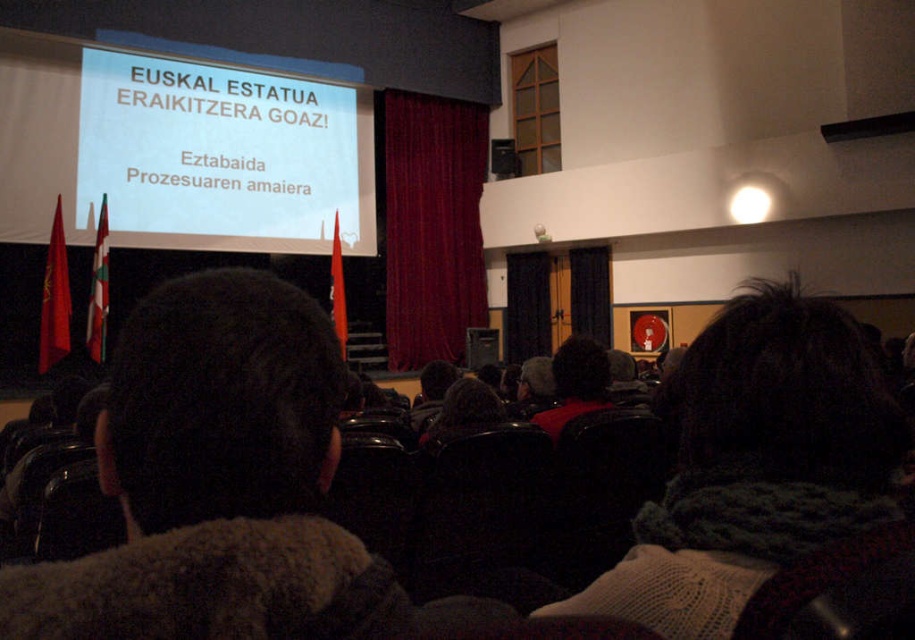
From the picture: Can you confirm if knitted scarf at center is positioned below white glossy projector screen at upper center?

Yes.

Which of these two, knitted scarf at center or white glossy projector screen at upper center, stands shorter?

Standing shorter between the two is knitted scarf at center.

Who is more distant from viewer, (782, 412) or (156, 182)?

The point (156, 182) is behind.

This screenshot has width=915, height=640. Find the location of `knitted scarf at center`. knitted scarf at center is located at coordinates (756, 461).

Is point (321, 353) farther from camera compared to point (608, 339)?

No, (321, 353) is in front of (608, 339).

How much distance is there between dark brown fur coat at center and black fabric curtain at center?

A distance of 10.45 meters exists between dark brown fur coat at center and black fabric curtain at center.

Is point (302, 564) closer to camera compared to point (607, 257)?

Yes, point (302, 564) is closer to viewer.

Where is `dark brown fur coat at center`? dark brown fur coat at center is located at coordinates (216, 483).

Does dark brown fur coat at center appear under white glossy projector screen at upper center?

Yes, dark brown fur coat at center is below white glossy projector screen at upper center.

Can you confirm if dark brown fur coat at center is thinner than white glossy projector screen at upper center?

Yes, dark brown fur coat at center is thinner than white glossy projector screen at upper center.

Which is in front, point (174, 369) or point (284, 161)?

Point (174, 369) is more forward.

The image size is (915, 640). Identify the location of dark brown fur coat at center. (216, 483).